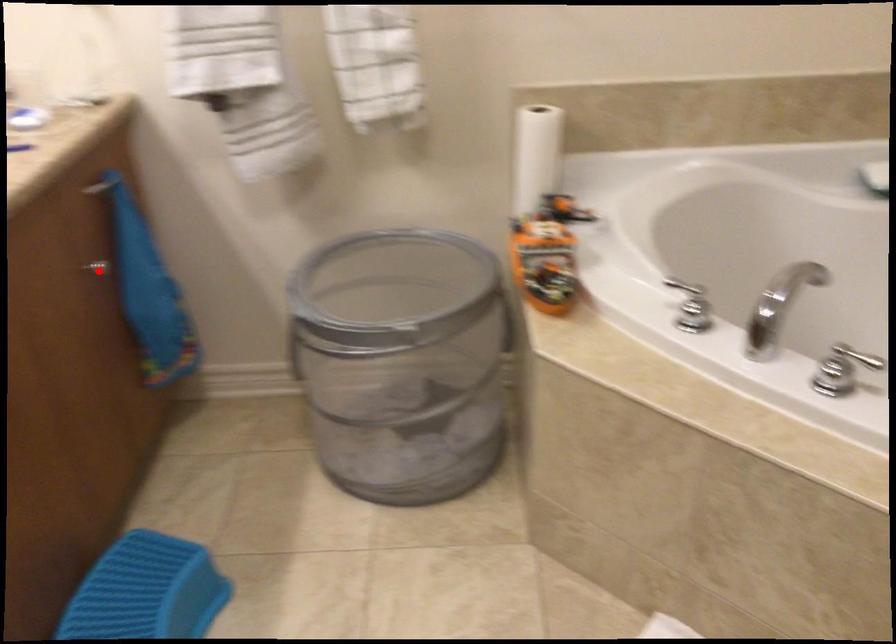
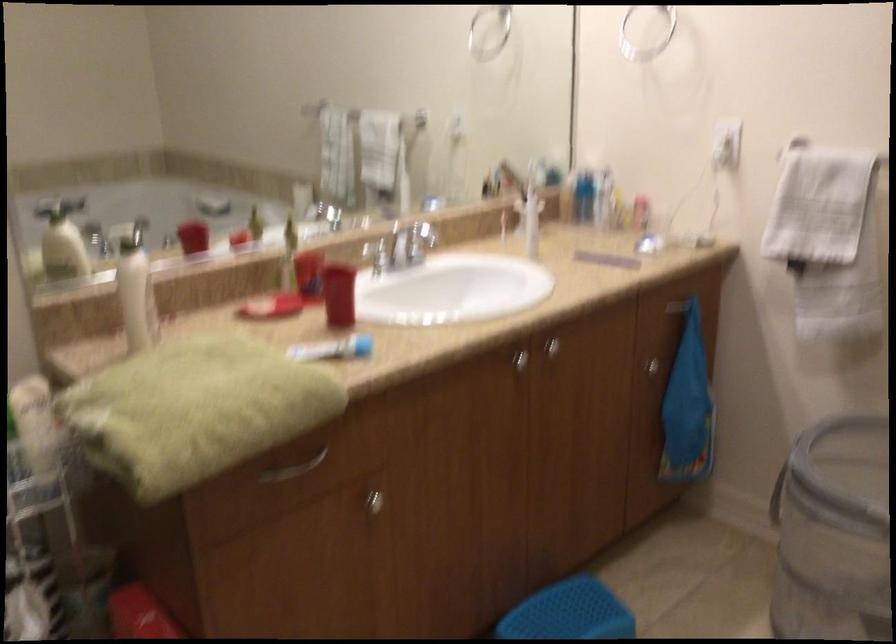
The point at the highlighted location is marked in the first image. Where is the corresponding point in the second image?

(650, 366)